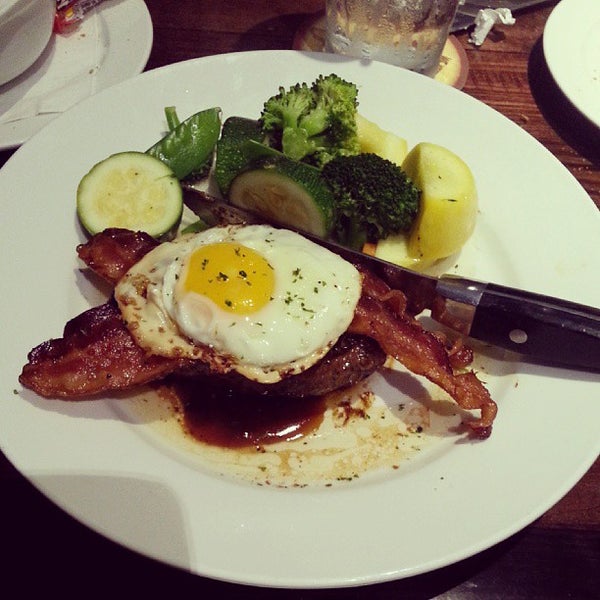
Locate an element on the screen. The image size is (600, 600). plate is located at coordinates (127, 45), (143, 112), (562, 57).